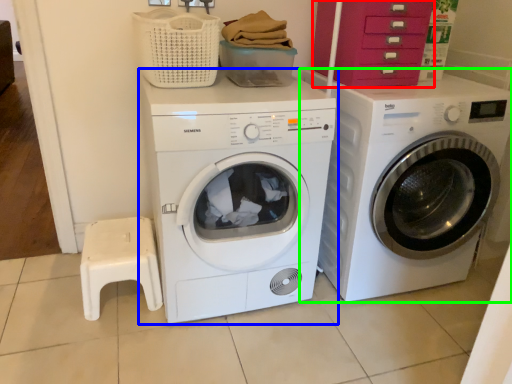
Question: Considering the real-world distances, which object is farthest from drawer (highlighted by a red box)? washing machine (highlighted by a blue box) or washing machine (highlighted by a green box)?

Choices:
 (A) washing machine
 (B) washing machine

Answer: (A)